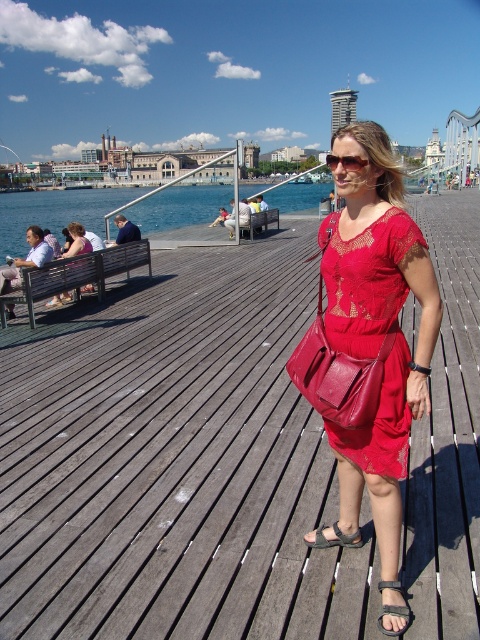
You are an artist trying to sketch the waterfront promenade scene. You want to place the red lace dress at center accurately in your drawing. What are the coordinates where you should position it?

The red lace dress at center should be positioned at coordinates approximately 0.439 on the x axis and 0.762 on the y axis.

You are a photographer trying to capture both the leather at center and the matte black dress at center in the same frame. Which object should you focus on first to ensure both are in the frame?

The leather at center is taller than the matte black dress at center, so you should focus on the leather at center first to ensure both are in the frame.